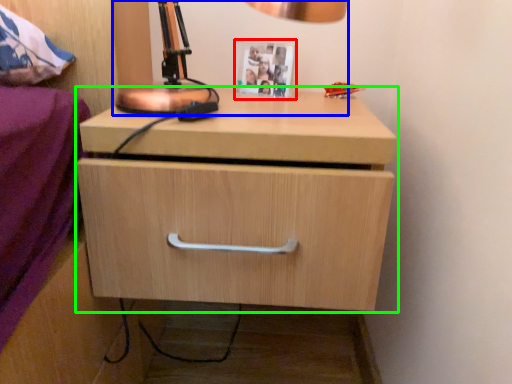
Question: Based on their relative distances, which object is nearer to picture frame (highlighted by a red box)? Choose from table lamp (highlighted by a blue box) and chest of drawers (highlighted by a green box).

Choices:
 (A) table lamp
 (B) chest of drawers

Answer: (A)